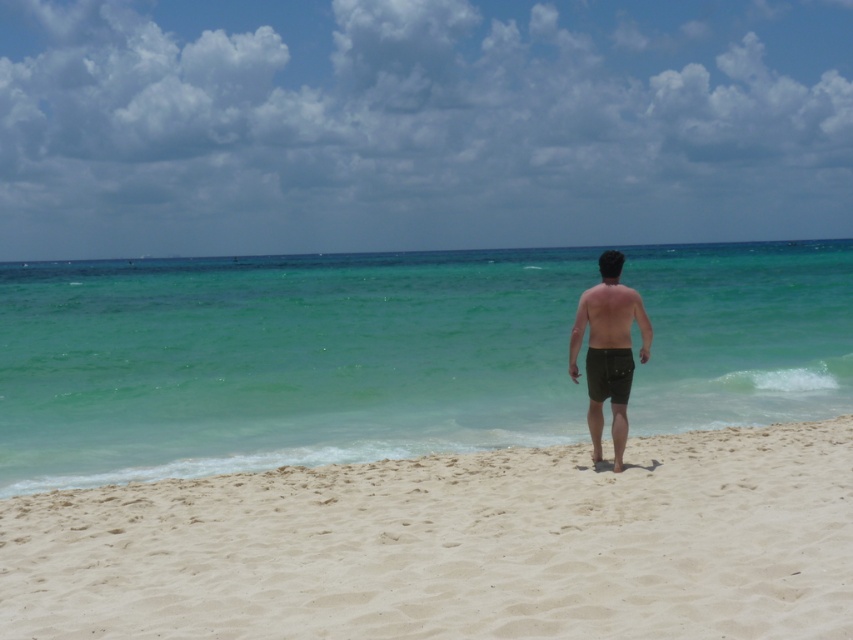
Question: Does clear water at center lie in front of brown cotton shorts at center?

Choices:
 (A) yes
 (B) no

Answer: (B)

Question: Does white sandy beach at center appear under black matte shorts at center?

Choices:
 (A) no
 (B) yes

Answer: (B)

Question: Among these objects, which one is nearest to the camera?

Choices:
 (A) clear water at center
 (B) brown matte shorts at center

Answer: (B)

Question: Can you confirm if clear water at center is positioned below brown cotton shorts at center?

Choices:
 (A) no
 (B) yes

Answer: (A)

Question: Which object is the farthest from the black matte shorts at center?

Choices:
 (A) brown matte shorts at center
 (B) clear water at center

Answer: (B)

Question: Among these points, which one is nearest to the camera?

Choices:
 (A) (598, 364)
 (B) (616, 296)
 (C) (213, 388)
 (D) (573, 349)

Answer: (B)